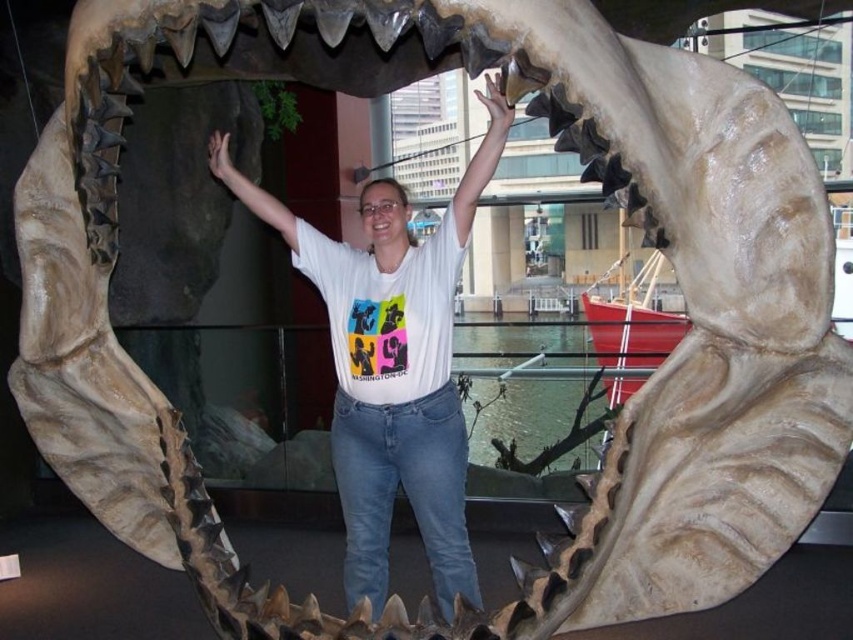
From the picture: Which is more to the right, white matte t-shirt at center or matte white teeth at center?

From the viewer's perspective, white matte t-shirt at center appears more on the right side.

Does white matte t-shirt at center have a greater width compared to matte white teeth at center?

Correct, the width of white matte t-shirt at center exceeds that of matte white teeth at center.

Is point (383, 285) closer to viewer compared to point (372, 227)?

Yes.

Where is `white matte t-shirt at center`? The image size is (853, 640). white matte t-shirt at center is located at coordinates (392, 365).